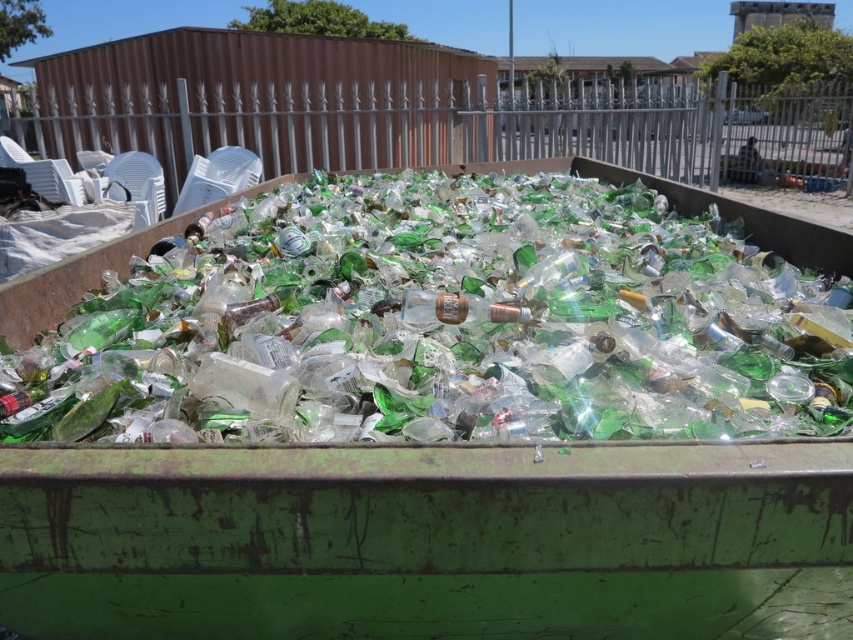
You are standing in front of the green metal container filled with broken glass bottles. There are two points marked on the container at coordinates point (120, 296) and point (419, 314). If you want to reach the point closer to you, which one should you aim for?

You should aim for point (120, 296) because it is closer to you than point (419, 314).

You are standing in front of the large green metal container. You need to pick up the green glass bottles at center and the clear glass bottle at center. Which one should you reach for first to avoid bending over too much?

The green glass bottles at center are closer to the viewer than the clear glass bottle at center, so you should reach for the green glass bottles at center first to avoid bending over too much.